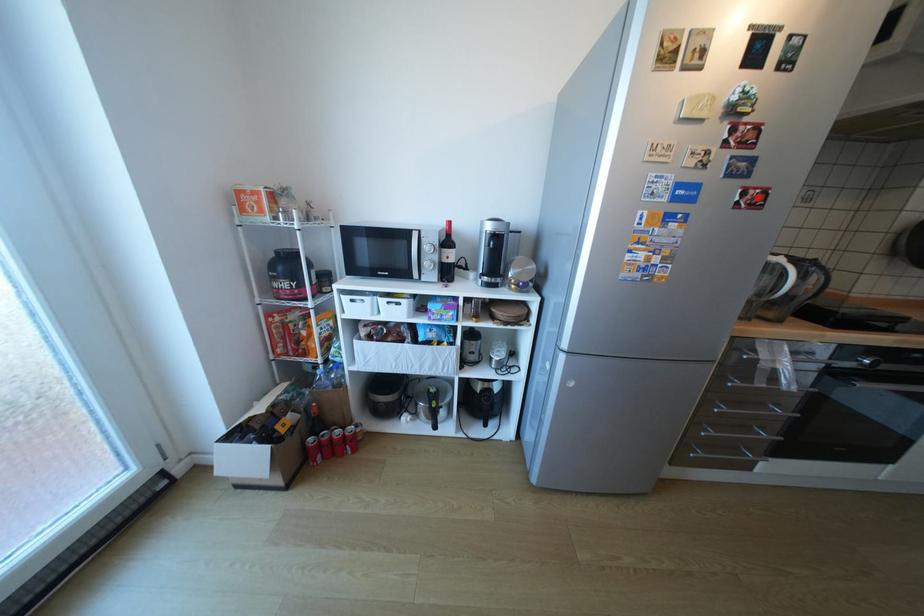
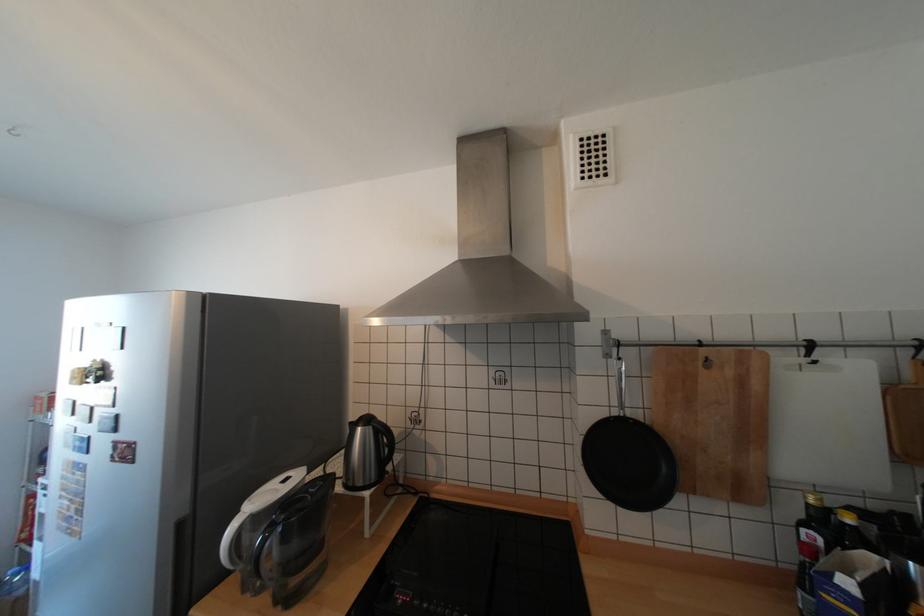
The point at the highlighted location is marked in the first image. Where is the corresponding point in the second image?

(128, 451)